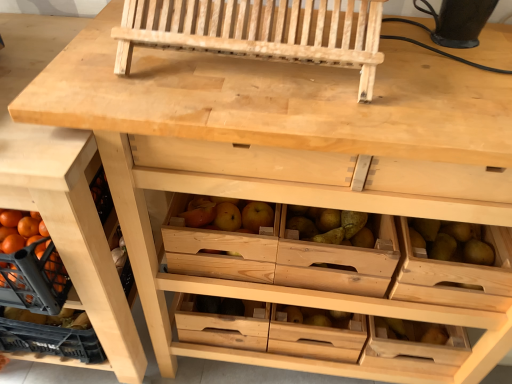
The image size is (512, 384). What are the coordinates of `natural wood drawer at lower left` in the screenshot? It's located at (63, 191).

This screenshot has width=512, height=384. Describe the element at coordinates (316, 333) in the screenshot. I see `wooden drawer at center, the second drawer in the front-to-back sequence` at that location.

At what (x,y) coordinates should I click in order to perform the action: click on wooden drawer at right, which appears as the first drawer when viewed from the top. Please return your answer as a coordinate pair (x, y). The height and width of the screenshot is (384, 512). Looking at the image, I should click on (456, 275).

Consider the image. From the image's perspective, is wooden drawer at center, the second drawer in the front-to-back sequence, over natural wood drawer at lower left?

Actually, wooden drawer at center, the second drawer in the front-to-back sequence, appears below natural wood drawer at lower left in the image.

Which point is more forward, (339, 335) or (16, 165)?

The point (16, 165) is closer to the camera.

Is wooden drawer at center, positioned as the second drawer in top-to-bottom order, oriented towards natural wood drawer at lower left?

No.

Considering the sizes of objects wooden drawer at center, acting as the first drawer starting from the left, and natural wood drawer at lower left in the image provided, who is taller, wooden drawer at center, acting as the first drawer starting from the left, or natural wood drawer at lower left?

natural wood drawer at lower left.

Which object is positioned more to the left, wooden drawer at center, positioned as the second drawer in top-to-bottom order, or natural wood church bench at upper center?

natural wood church bench at upper center is more to the left.

Who is more distant, wooden drawer at center, arranged as the first drawer when viewed from the back, or natural wood church bench at upper center?

wooden drawer at center, arranged as the first drawer when viewed from the back, is more distant.

From a real-world perspective, is wooden drawer at center, which is the second drawer in right-to-left order, on top of natural wood church bench at upper center?

Actually, wooden drawer at center, which is the second drawer in right-to-left order, is physically below natural wood church bench at upper center in the real world.

Does point (282, 317) appear closer or farther from the camera than point (283, 6)?

Clearly, point (282, 317) is more distant from the camera than point (283, 6).

Is wooden drawer at right, which appears as the first drawer when viewed from the top, turned away from wooden drawer at center, acting as the first drawer starting from the left?

wooden drawer at right, which appears as the first drawer when viewed from the top, is not turned away from wooden drawer at center, acting as the first drawer starting from the left.

Is wooden drawer at right, the second drawer viewed from the left, inside or outside of wooden drawer at center, positioned as the second drawer in top-to-bottom order?

wooden drawer at right, the second drawer viewed from the left, lies outside wooden drawer at center, positioned as the second drawer in top-to-bottom order.

Between wooden drawer at right, acting as the second drawer starting from the back, and wooden drawer at center, arranged as the first drawer when viewed from the back, which one appears on the left side from the viewer's perspective?

wooden drawer at center, arranged as the first drawer when viewed from the back, is more to the left.

From the image's perspective, is wooden drawer at right, which appears as the first drawer when viewed from the top, on top of wooden drawer at center, positioned as the second drawer in top-to-bottom order?

Indeed, from the image's perspective, wooden drawer at right, which appears as the first drawer when viewed from the top, is shown above wooden drawer at center, positioned as the second drawer in top-to-bottom order.

Can you confirm if wooden drawer at center, positioned as the second drawer in top-to-bottom order, is wider than wooden drawer at right, which ranks as the 1th drawer in right-to-left order?

Incorrect, the width of wooden drawer at center, positioned as the second drawer in top-to-bottom order, does not surpass that of wooden drawer at right, which ranks as the 1th drawer in right-to-left order.

Does wooden drawer at center, arranged as the first drawer when viewed from the back, turn towards wooden drawer at right, the second drawer viewed from the left?

No, wooden drawer at center, arranged as the first drawer when viewed from the back, does not turn towards wooden drawer at right, the second drawer viewed from the left.

Which object is positioned more to the right, wooden drawer at center, acting as the first drawer starting from the left, or wooden drawer at right, which appears as the first drawer when viewed from the top?

wooden drawer at right, which appears as the first drawer when viewed from the top.

Is the position of wooden drawer at center, acting as the first drawer starting from the left, less distant than that of wooden drawer at right, the first drawer when ordered from front to back?

No, the depth of wooden drawer at center, acting as the first drawer starting from the left, is greater than that of wooden drawer at right, the first drawer when ordered from front to back.

From the image's perspective, is natural wood church bench at upper center above or below wooden drawer at center, acting as the first drawer starting from the left?

Based on their image positions, natural wood church bench at upper center is located above wooden drawer at center, acting as the first drawer starting from the left.

In the scene shown: Is natural wood church bench at upper center further to the viewer compared to wooden drawer at center, which is the second drawer in right-to-left order?

That is False.

From the image's perspective, count 2nd drawers downward from the natural wood church bench at upper center and point to it. Please provide its 2D coordinates.

[(316, 333)]

Is natural wood church bench at upper center placed right next to wooden drawer at center, the second drawer in the front-to-back sequence?

They are not placed beside each other.

From a real-world perspective, is wooden drawer at right, the first drawer when ordered from front to back, physically above natural wood drawer at lower left?

Indeed, from a real-world perspective, wooden drawer at right, the first drawer when ordered from front to back, stands above natural wood drawer at lower left.

Which of these two, wooden drawer at right, the first drawer when ordered from front to back, or natural wood drawer at lower left, is wider?

Wider between the two is natural wood drawer at lower left.

Could you tell me if wooden drawer at right, which appears as the first drawer when viewed from the top, is facing natural wood drawer at lower left?

No, wooden drawer at right, which appears as the first drawer when viewed from the top, is not oriented towards natural wood drawer at lower left.

Is wooden drawer at right, which appears as the first drawer when viewed from the top, taller than natural wood drawer at lower left?

No.

Which of these two, natural wood drawer at lower left or natural wood church bench at upper center, stands taller?

With more height is natural wood drawer at lower left.

In terms of size, does natural wood drawer at lower left appear bigger or smaller than natural wood church bench at upper center?

Clearly, natural wood drawer at lower left is larger in size than natural wood church bench at upper center.

From a real-world perspective, is natural wood drawer at lower left located beneath natural wood church bench at upper center?

Yes, from a real-world perspective, natural wood drawer at lower left is below natural wood church bench at upper center.

Is natural wood drawer at lower left completely or partially outside of natural wood church bench at upper center?

Absolutely, natural wood drawer at lower left is external to natural wood church bench at upper center.

In order to click on shelf above the wooden drawer at center, which is the second drawer in right-to-left order (from a real-world perspective) in this screenshot , I will do `click(63, 191)`.

Find the location of a particular element. church bench that is in front of the wooden drawer at center, arranged as the first drawer when viewed from the back is located at coordinates (258, 32).

From the picture: Estimate the real-world distances between objects in this image. Which object is further from wooden drawer at center, acting as the first drawer starting from the left, wooden drawer at right, which appears as the first drawer when viewed from the top, or natural wood church bench at upper center?

The object further to wooden drawer at center, acting as the first drawer starting from the left, is natural wood church bench at upper center.

Looking at the image, which one is located closer to wooden drawer at right, acting as the second drawer starting from the back, natural wood church bench at upper center or wooden drawer at center, which is the second drawer in right-to-left order?

wooden drawer at center, which is the second drawer in right-to-left order, is closer to wooden drawer at right, acting as the second drawer starting from the back.

Estimate the real-world distances between objects in this image. Which object is further from wooden drawer at center, which is the second drawer in right-to-left order, natural wood church bench at upper center or wooden drawer at right, the second drawer viewed from the left?

natural wood church bench at upper center is positioned further to the anchor wooden drawer at center, which is the second drawer in right-to-left order.

Based on their spatial positions, is natural wood drawer at lower left or wooden drawer at right, which appears as the first drawer when viewed from the top, closer to natural wood church bench at upper center?

The object closer to natural wood church bench at upper center is natural wood drawer at lower left.

Estimate the real-world distances between objects in this image. Which object is closer to wooden drawer at center, acting as the first drawer starting from the left, natural wood church bench at upper center or natural wood drawer at lower left?

The object closer to wooden drawer at center, acting as the first drawer starting from the left, is natural wood drawer at lower left.

Estimate the real-world distances between objects in this image. Which object is further from natural wood drawer at lower left, wooden drawer at right, the second drawer when ordered from bottom to top, or natural wood church bench at upper center?

wooden drawer at right, the second drawer when ordered from bottom to top.

Based on their spatial positions, is wooden drawer at center, which is the first drawer in bottom-to-top order, or natural wood drawer at lower left further from natural wood church bench at upper center?

Based on the image, wooden drawer at center, which is the first drawer in bottom-to-top order, appears to be further to natural wood church bench at upper center.

Considering their positions, is wooden drawer at center, which is the second drawer in right-to-left order, positioned closer to natural wood church bench at upper center than wooden drawer at right, the second drawer viewed from the left?

The object closer to natural wood church bench at upper center is wooden drawer at right, the second drawer viewed from the left.

This screenshot has height=384, width=512. I want to click on church bench located between natural wood drawer at lower left and wooden drawer at center, acting as the first drawer starting from the left, in the left-right direction, so click(258, 32).

Where is `drawer between natural wood church bench at upper center and wooden drawer at center, the second drawer in the front-to-back sequence, in the vertical direction`? This screenshot has height=384, width=512. drawer between natural wood church bench at upper center and wooden drawer at center, the second drawer in the front-to-back sequence, in the vertical direction is located at coordinates click(x=456, y=275).

The height and width of the screenshot is (384, 512). Find the location of `drawer between natural wood drawer at lower left and wooden drawer at right, the second drawer viewed from the left`. drawer between natural wood drawer at lower left and wooden drawer at right, the second drawer viewed from the left is located at coordinates (316, 333).

Locate an element on the screen. The height and width of the screenshot is (384, 512). church bench between natural wood drawer at lower left and wooden drawer at right, acting as the second drawer starting from the back is located at coordinates (258, 32).